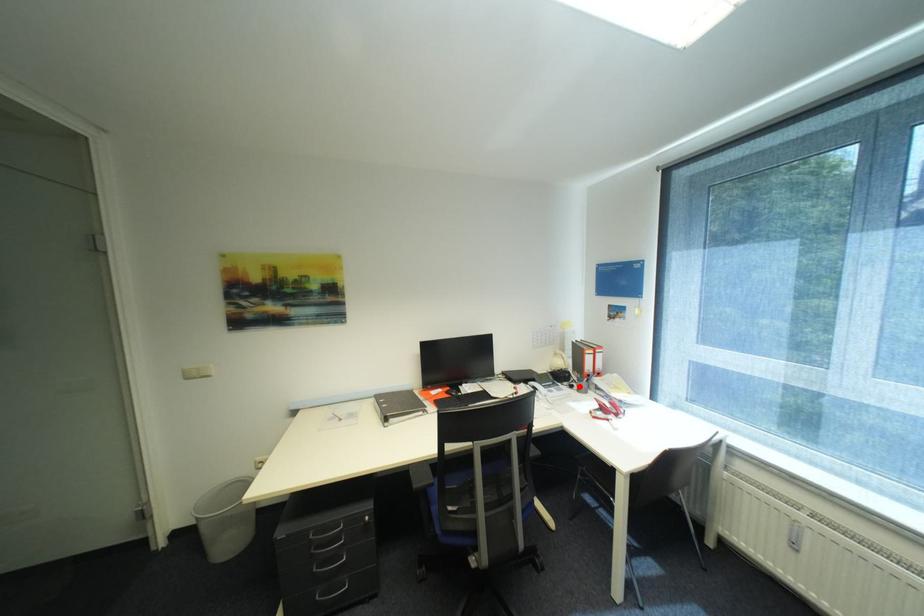
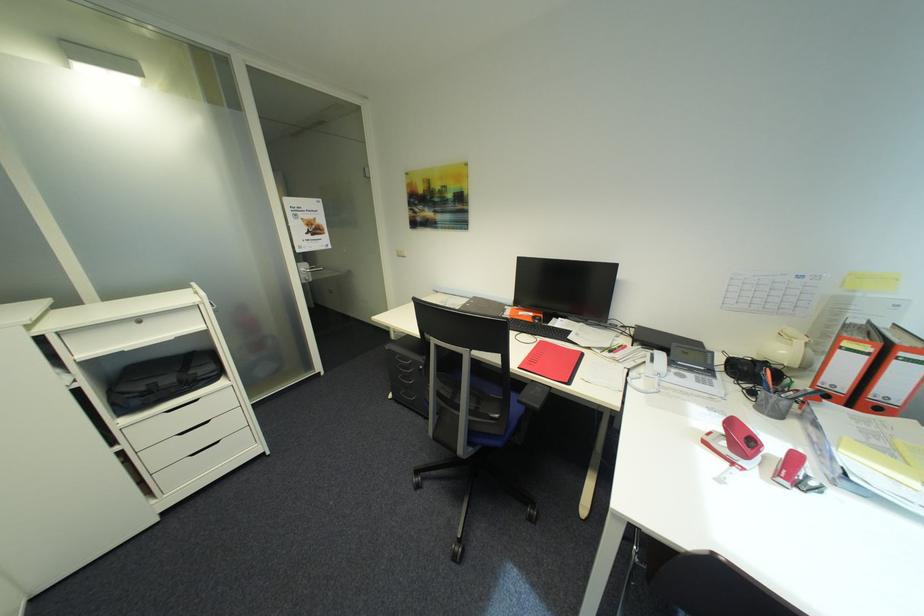
Find the pixel in the second image that matches the highlighted location in the first image.

(760, 392)